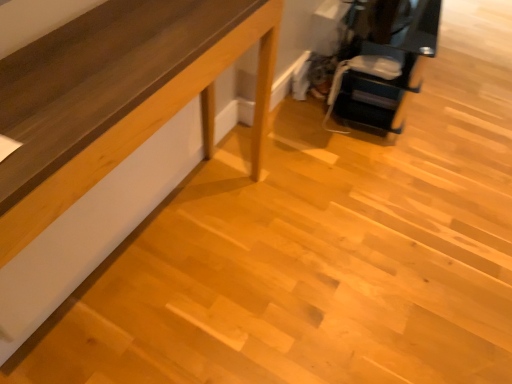
I want to click on vacant space to the right of light brown wood table at lower left, marked as the 2th furniture in a right-to-left arrangement, so click(293, 229).